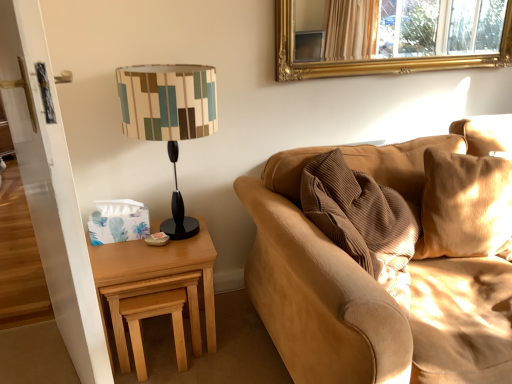
I want to click on spots to the right of light brown wood at left, so click(x=239, y=337).